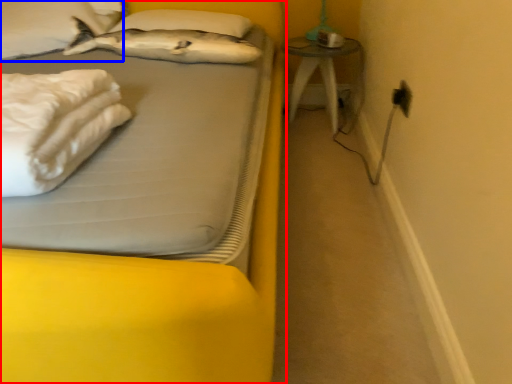
Question: Which object is closer to the camera taking this photo, bed (highlighted by a red box) or pillow (highlighted by a blue box)?

Choices:
 (A) bed
 (B) pillow

Answer: (A)